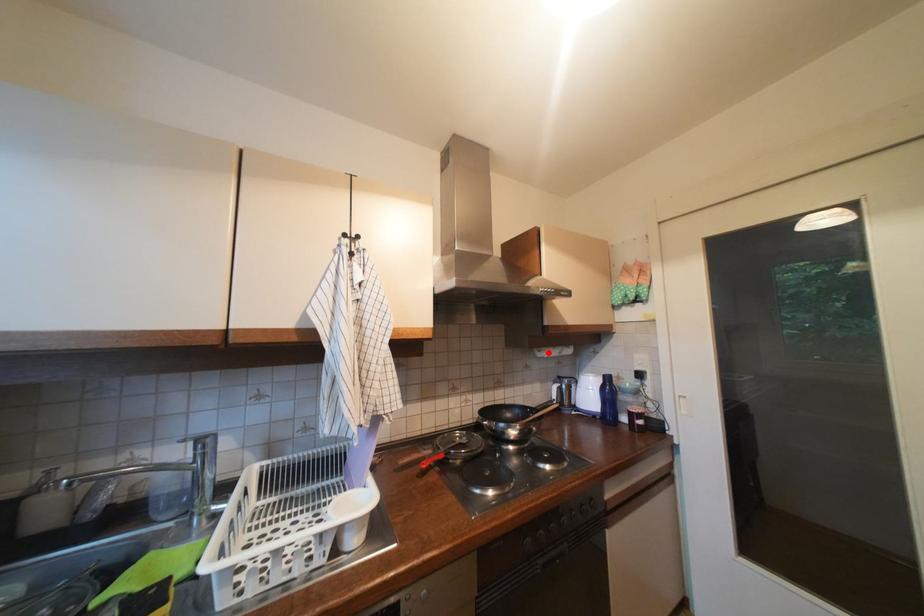
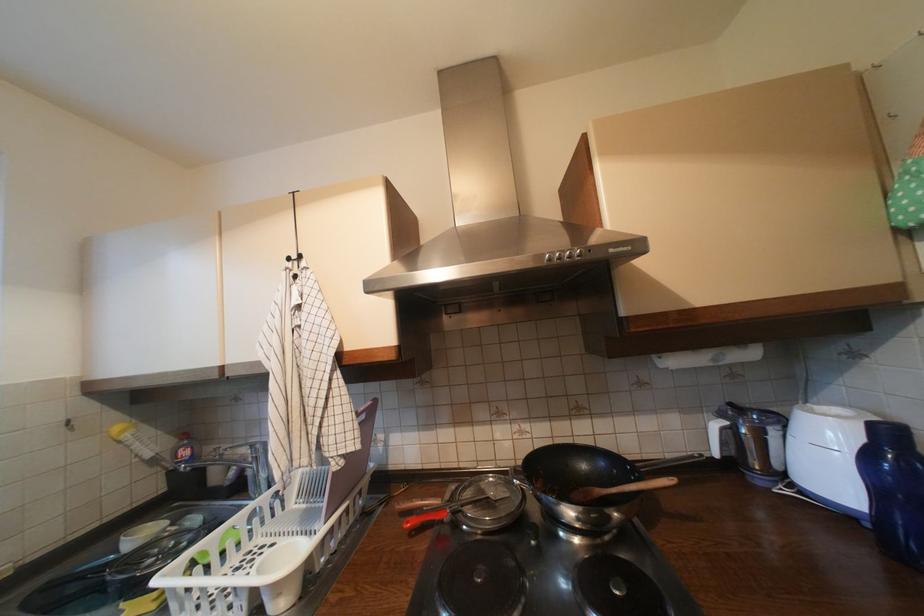
Locate, in the second image, the point that corresponds to the highlighted location in the first image.

(669, 359)